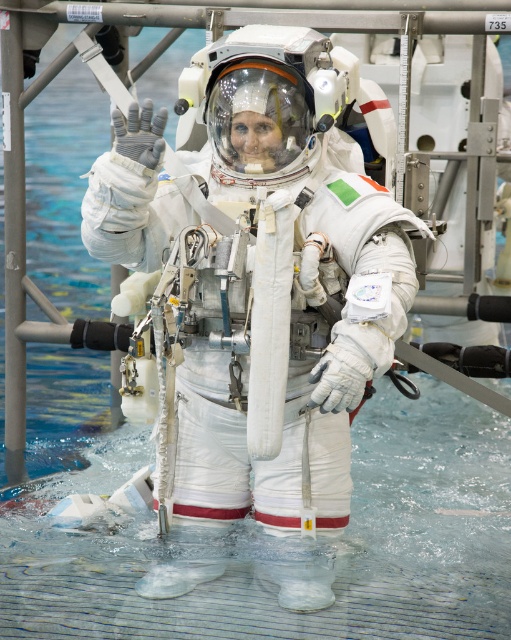
You are an astronaut in the training facility and need to retrieve two items marked as point coordinates. The first item is at point (296,525) and the second is at point (126,568). Which item should you reach for first if you want to minimize the distance you have to move?

Point (296,525) is closer to the viewer than point (126,568), so you should reach for the item at point (296,525) first as it requires less movement.

You are an engineer inspecting a training facility. You see the white matte spacesuit at center and the clear plastic water at center. Which object is located to the right of the other?

The clear plastic water at center is located to the right of the white matte spacesuit at center because the white matte spacesuit at center is positioned on the left side of clear plastic water at center.

You are an astronaut in a training facility. You need to step onto a floating platform that is placed on the clear plastic water at center. Can you safely step onto it while wearing the white matte spacesuit at center?

The white matte spacesuit at center is positioned over clear plastic water at center, so stepping onto the floating platform on the clear plastic water at center would be possible as the spacesuit is already over the water. However, safety depends on the platform stability and training protocols.